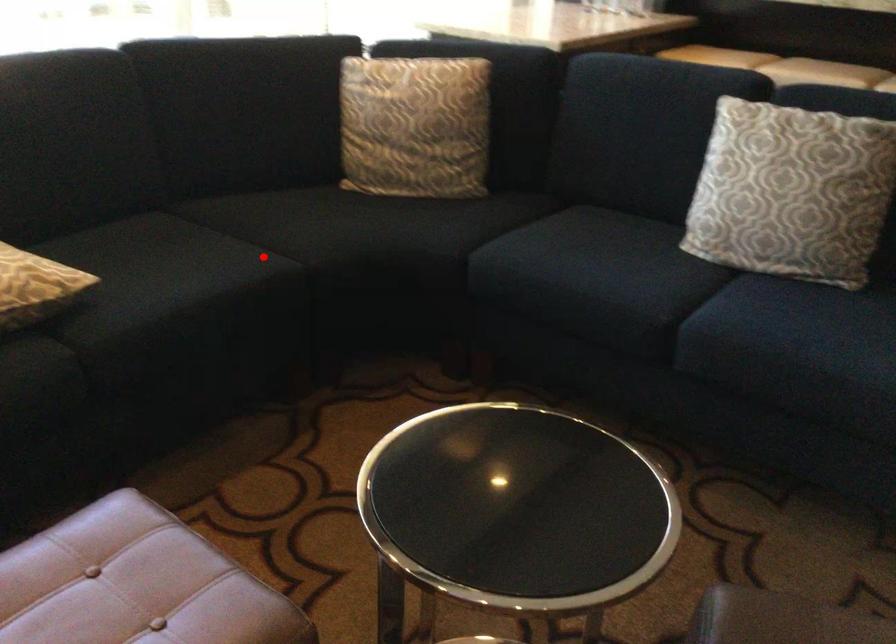
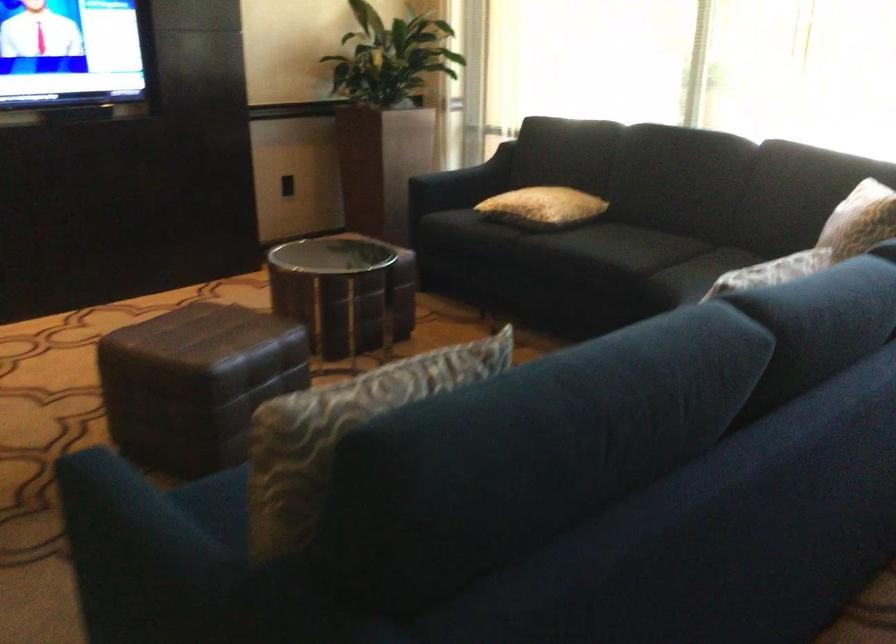
Find the pixel in the second image that matches the highlighted location in the first image.

(626, 254)